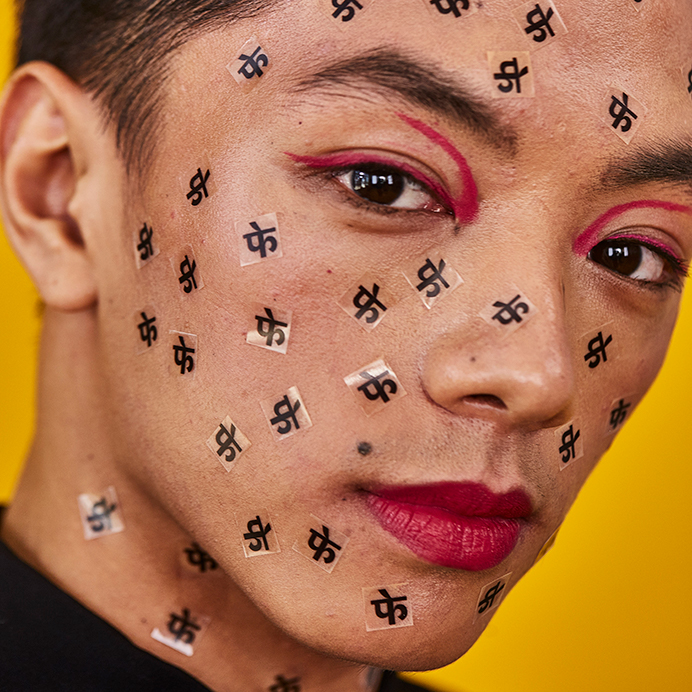
At what (x,y) coordinates should I click in order to perform the action: click on sticker. Please return your answer as a coordinate pair (x, y). Looking at the image, I should click on (95, 519).